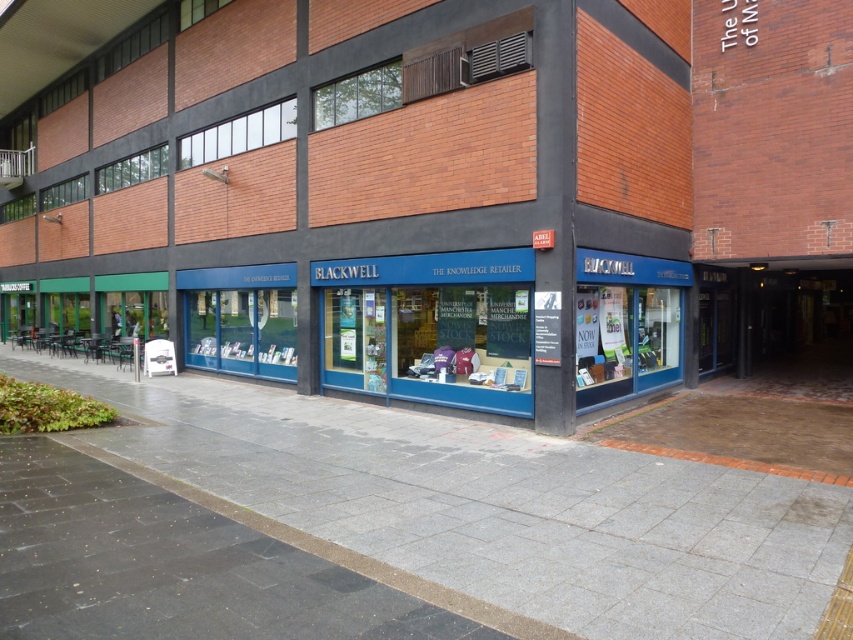
Question: Is blue glass storefront at center bigger than gray concrete pavement at center?

Choices:
 (A) no
 (B) yes

Answer: (B)

Question: Does blue glass storefront at center lie behind gray concrete pavement at center?

Choices:
 (A) yes
 (B) no

Answer: (A)

Question: Can you confirm if blue glass storefront at center is positioned above gray concrete pavement at center?

Choices:
 (A) no
 (B) yes

Answer: (B)

Question: Which point appears farthest from the camera in this image?

Choices:
 (A) (416, 195)
 (B) (526, 634)

Answer: (A)

Question: Which point is farther to the camera?

Choices:
 (A) (529, 365)
 (B) (169, 483)

Answer: (A)